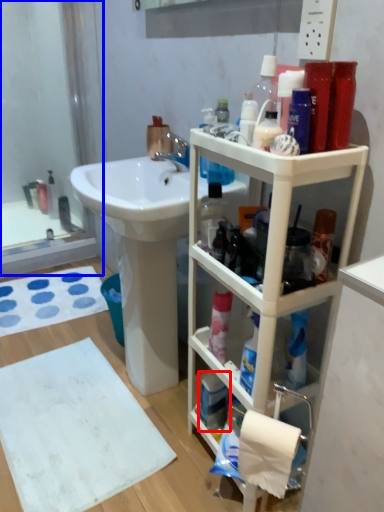
Question: Which object is closer to the camera taking this photo, mouthwash (highlighted by a red box) or glass door (highlighted by a blue box)?

Choices:
 (A) mouthwash
 (B) glass door

Answer: (A)